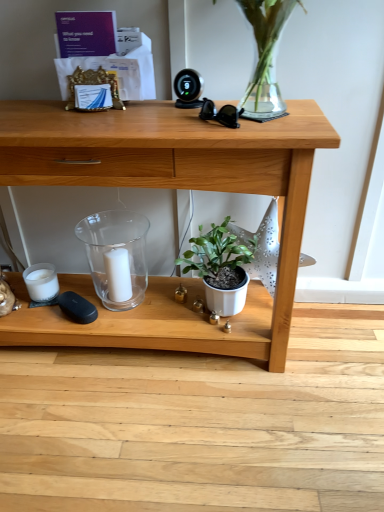
Where is `free spot above wooden desk at center (from a real-world perspective)`? Image resolution: width=384 pixels, height=512 pixels. free spot above wooden desk at center (from a real-world perspective) is located at coordinates click(x=121, y=116).